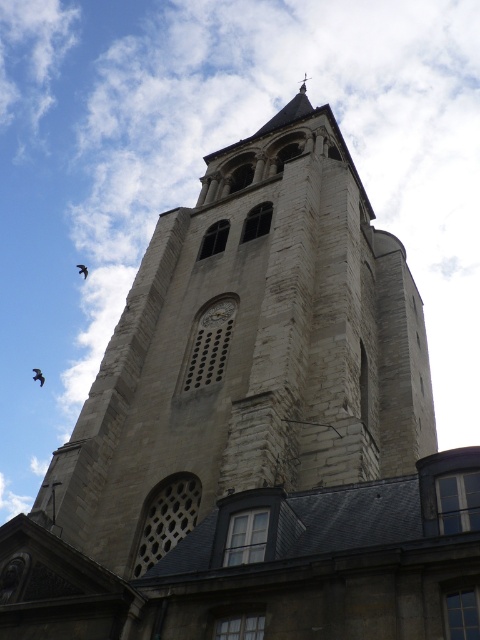
Describe the element at coordinates (38, 376) in the screenshot. I see `black feathered bird at upper left` at that location.

Who is taller, black feathered bird at upper left or brown feathered bird at upper left?

With more height is black feathered bird at upper left.

Where is `black feathered bird at upper left`? The height and width of the screenshot is (640, 480). black feathered bird at upper left is located at coordinates (38, 376).